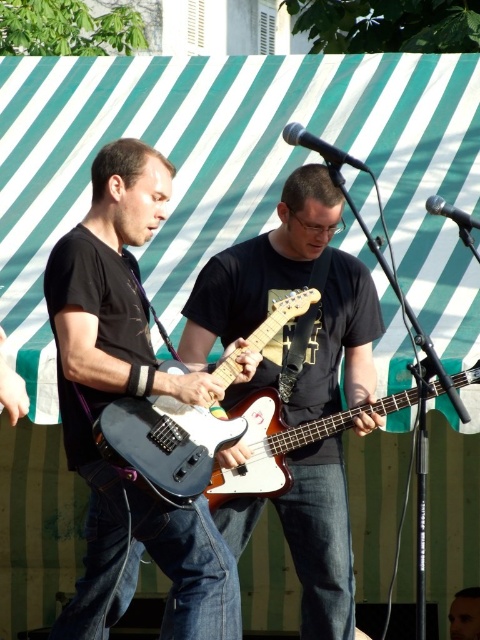
Image resolution: width=480 pixels, height=640 pixels. I want to click on matte black guitar at center, so click(290, 289).

Is matte black guitar at center taller than smooth skin face at center?

Yes, matte black guitar at center is taller than smooth skin face at center.

Identify the location of matte black guitar at center. (290, 289).

Locate an element on the screen. This screenshot has width=480, height=640. matte black guitar at center is located at coordinates (290, 289).

Is matte black electric guitar at center positioned behind white glossy bass guitar at center?

No, it is in front of white glossy bass guitar at center.

Does matte black electric guitar at center have a larger size compared to white glossy bass guitar at center?

No, matte black electric guitar at center is not bigger than white glossy bass guitar at center.

From the picture: Who is more distant from viewer, (x=244, y=492) or (x=276, y=474)?

The point (x=244, y=492) is behind.

Where is `matte black electric guitar at center`? The width and height of the screenshot is (480, 640). matte black electric guitar at center is located at coordinates (187, 445).

Measure the distance between matte black guitar at left and smooth skin face at center.

The distance of matte black guitar at left from smooth skin face at center is 6.88 meters.

Locate an element on the screen. matte black guitar at left is located at coordinates (131, 396).

Find the location of `matte black guitar at left`. matte black guitar at left is located at coordinates (131, 396).